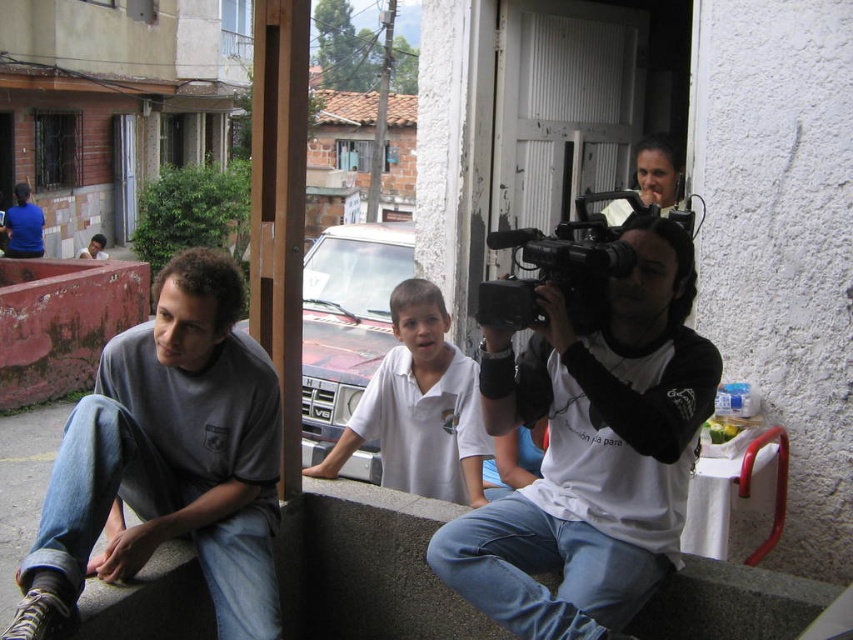
Is white matte camera at center positioned before black plastic video camera at center?

Yes.

Where is `white matte camera at center`? The width and height of the screenshot is (853, 640). white matte camera at center is located at coordinates (590, 452).

Locate an element on the screen. This screenshot has height=640, width=853. white matte camera at center is located at coordinates point(590,452).

How much distance is there between gray cotton shirt at left and white cotton shirt at center?

gray cotton shirt at left and white cotton shirt at center are 1.00 meters apart.

Measure the distance between gray cotton shirt at left and camera.

gray cotton shirt at left is 1.83 meters from camera.

Find the location of `gray cotton shirt at left`. gray cotton shirt at left is located at coordinates (167, 460).

Where is `gray cotton shirt at left`? This screenshot has height=640, width=853. gray cotton shirt at left is located at coordinates (167, 460).

Is white matte camera at center taller than gray cotton shirt at left?

No, white matte camera at center is not taller than gray cotton shirt at left.

Between point (550, 458) and point (135, 445), which one is positioned behind?

The point (550, 458) is more distant.

You are a GUI agent. You are given a task and a screenshot of the screen. Output one action in this format:
    pyautogui.click(x=<x>, y=<y>)
    Task: Click on the white matte camera at center
    
    Given the screenshot: What is the action you would take?
    pyautogui.click(x=590, y=452)